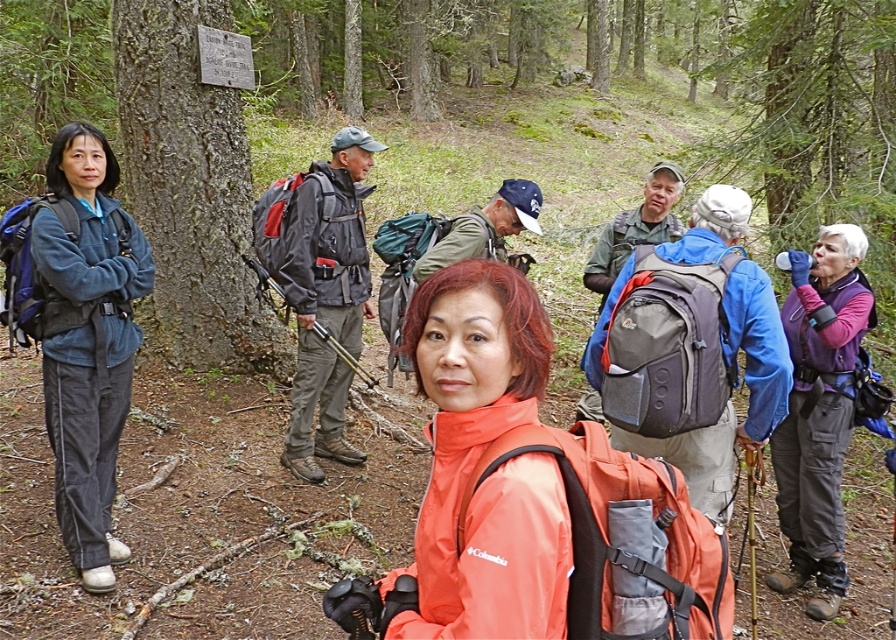
Question: Is smooth bark tree at left bigger than blue fleece jacket at left?

Choices:
 (A) no
 (B) yes

Answer: (B)

Question: Is blue fleece jacket at left positioned at the back of purple fleece vest at right?

Choices:
 (A) yes
 (B) no

Answer: (B)

Question: Does blue fleece jacket at left have a larger size compared to matte black jacket at center?

Choices:
 (A) yes
 (B) no

Answer: (B)

Question: Considering the real-world distances, which object is farthest from the blue fleece jacket at left?

Choices:
 (A) matte black jacket at center
 (B) purple fleece vest at right

Answer: (B)

Question: Which point is closer to the camera taking this photo?

Choices:
 (A) (173, 348)
 (B) (836, 308)
 (C) (93, 417)
 (D) (307, 248)

Answer: (C)

Question: Estimate the real-world distances between objects in this image. Which object is farther from the purple fleece vest at right?

Choices:
 (A) smooth bark tree at left
 (B) matte black jacket at center
 (C) blue fleece jacket at left

Answer: (A)